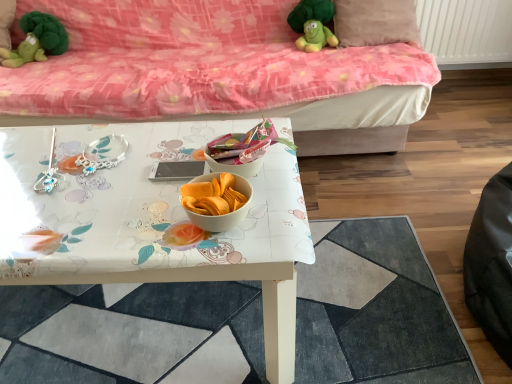
Question: Is velvet pink couch at upper center oriented away from white glossy table at center?

Choices:
 (A) no
 (B) yes

Answer: (A)

Question: Are velvet pink couch at upper center and white glossy table at center making contact?

Choices:
 (A) yes
 (B) no

Answer: (B)

Question: Can you confirm if velvet pink couch at upper center is positioned to the left of white glossy table at center?

Choices:
 (A) yes
 (B) no

Answer: (A)

Question: Considering the relative sizes of velvet pink couch at upper center and white glossy table at center in the image provided, is velvet pink couch at upper center shorter than white glossy table at center?

Choices:
 (A) yes
 (B) no

Answer: (B)

Question: Is velvet pink couch at upper center positioned behind white glossy table at center?

Choices:
 (A) no
 (B) yes

Answer: (B)

Question: Can you confirm if velvet pink couch at upper center is smaller than white glossy table at center?

Choices:
 (A) yes
 (B) no

Answer: (B)

Question: Does green plush toy at upper center, the 2th toy when ordered from left to right, touch velvet pink couch at upper center?

Choices:
 (A) yes
 (B) no

Answer: (B)

Question: From the image's perspective, is green plush toy at upper center, the first toy in the right-to-left sequence, beneath velvet pink couch at upper center?

Choices:
 (A) no
 (B) yes

Answer: (A)

Question: Can you confirm if green plush toy at upper center, the first toy in the right-to-left sequence, is taller than velvet pink couch at upper center?

Choices:
 (A) yes
 (B) no

Answer: (B)

Question: Is there a large distance between green plush toy at upper center, the first toy in the right-to-left sequence, and velvet pink couch at upper center?

Choices:
 (A) no
 (B) yes

Answer: (A)

Question: Is green plush toy at upper center, the first toy in the right-to-left sequence, closer to the viewer compared to velvet pink couch at upper center?

Choices:
 (A) no
 (B) yes

Answer: (A)

Question: Considering the relative positions of green plush toy at upper center, the 2th toy when ordered from left to right, and velvet pink couch at upper center in the image provided, is green plush toy at upper center, the 2th toy when ordered from left to right, to the left of velvet pink couch at upper center from the viewer's perspective?

Choices:
 (A) no
 (B) yes

Answer: (A)

Question: Does green plush toy at upper left, the 2th toy when ordered from right to left, have a lesser height compared to white glossy table at center?

Choices:
 (A) no
 (B) yes

Answer: (A)